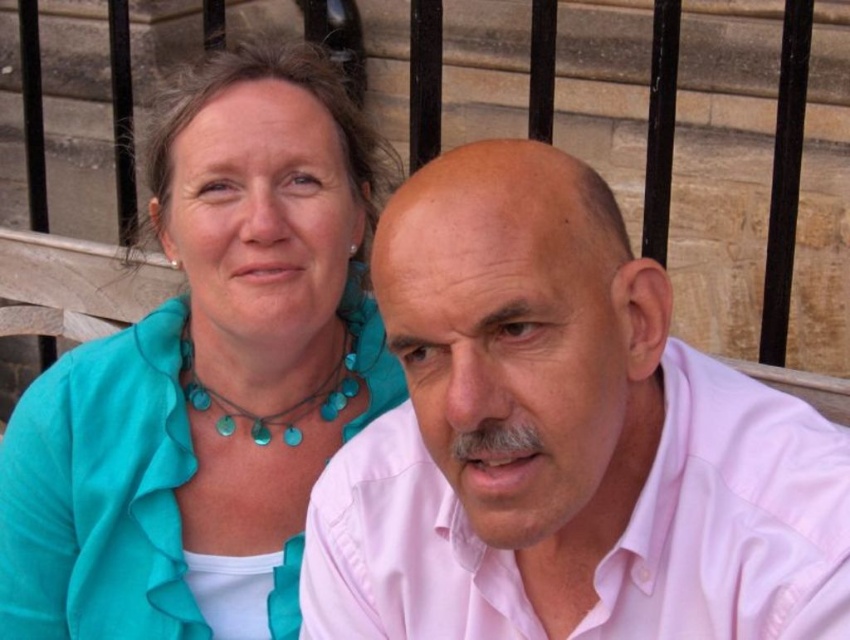
Question: Which point appears farthest from the camera in this image?

Choices:
 (A) (258, 435)
 (B) (391, 273)

Answer: (A)

Question: Is pink cotton shirt at center positioned behind teal fabric blouse at upper left?

Choices:
 (A) yes
 (B) no

Answer: (B)

Question: Is teal fabric blouse at upper left closer to camera compared to turquoise beads at center?

Choices:
 (A) no
 (B) yes

Answer: (B)

Question: Which point appears farthest from the camera in this image?

Choices:
 (A) (525, 541)
 (B) (248, 348)

Answer: (B)

Question: Among these points, which one is nearest to the camera?

Choices:
 (A) (187, 346)
 (B) (371, 593)

Answer: (B)

Question: Where is pink cotton shirt at center located in relation to turquoise beads at center in the image?

Choices:
 (A) right
 (B) left

Answer: (A)